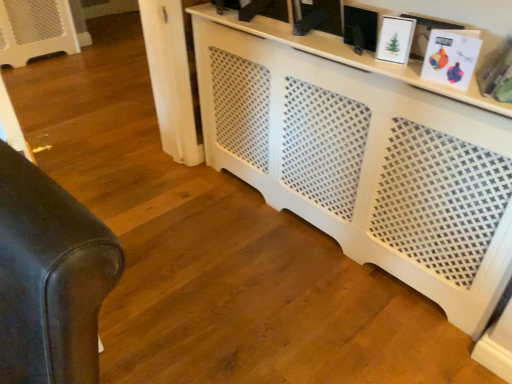
Question: Is matte black picture frame at upper center, which is the 1th picture frame in left-to-right order, at the back of white matte picture frame at upper right, placed as the 1th picture frame when sorted from right to left?

Choices:
 (A) yes
 (B) no

Answer: (B)

Question: Is white matte picture frame at upper right, the third picture frame from the left, outside matte black picture frame at upper center, which appears as the third picture frame when viewed from the right?

Choices:
 (A) no
 (B) yes

Answer: (B)

Question: Does white matte picture frame at upper right, the third picture frame from the left, appear on the right side of matte black picture frame at upper center, which appears as the third picture frame when viewed from the right?

Choices:
 (A) yes
 (B) no

Answer: (A)

Question: Considering the relative positions of white matte picture frame at upper right, placed as the 1th picture frame when sorted from right to left, and matte black picture frame at upper center, which appears as the third picture frame when viewed from the right, in the image provided, is white matte picture frame at upper right, placed as the 1th picture frame when sorted from right to left, to the left of matte black picture frame at upper center, which appears as the third picture frame when viewed from the right, from the viewer's perspective?

Choices:
 (A) no
 (B) yes

Answer: (A)

Question: From a real-world perspective, is white matte picture frame at upper right, placed as the 1th picture frame when sorted from right to left, physically above matte black picture frame at upper center, which appears as the third picture frame when viewed from the right?

Choices:
 (A) yes
 (B) no

Answer: (A)

Question: Is the surface of white matte picture frame at upper right, placed as the 1th picture frame when sorted from right to left, in direct contact with matte black picture frame at upper center, which is the 1th picture frame in left-to-right order?

Choices:
 (A) no
 (B) yes

Answer: (A)

Question: Considering the relative sizes of white glossy picture frame at upper right, the second picture frame from the left, and leather couch at left in the image provided, is white glossy picture frame at upper right, the second picture frame from the left, shorter than leather couch at left?

Choices:
 (A) no
 (B) yes

Answer: (B)

Question: Is white glossy picture frame at upper right, the second picture frame from the left, smaller than leather couch at left?

Choices:
 (A) no
 (B) yes

Answer: (B)

Question: Can you see white glossy picture frame at upper right, the 2th picture frame positioned from the right, touching leather couch at left?

Choices:
 (A) no
 (B) yes

Answer: (A)

Question: From a real-world perspective, is white glossy picture frame at upper right, the 2th picture frame positioned from the right, located beneath leather couch at left?

Choices:
 (A) no
 (B) yes

Answer: (A)

Question: Considering the relative positions of white glossy picture frame at upper right, the second picture frame from the left, and leather couch at left in the image provided, is white glossy picture frame at upper right, the second picture frame from the left, in front of leather couch at left?

Choices:
 (A) no
 (B) yes

Answer: (A)

Question: Is white glossy picture frame at upper right, the second picture frame from the left, located outside leather couch at left?

Choices:
 (A) yes
 (B) no

Answer: (A)

Question: Considering the relative positions of white perforated cabinet at center and matte black picture frame at upper center, which is the 1th picture frame in left-to-right order, in the image provided, is white perforated cabinet at center behind matte black picture frame at upper center, which is the 1th picture frame in left-to-right order,?

Choices:
 (A) no
 (B) yes

Answer: (A)